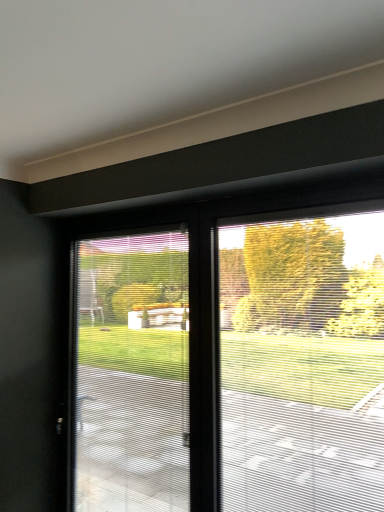
Question: Which direction should I rotate to face clear plastic window screen at center, which is the 1th window screen from left to right, — up or down?

Choices:
 (A) up
 (B) down

Answer: (B)

Question: Which direction should I rotate to look at frosted glass window screen at center, the first window screen when ordered from right to left?

Choices:
 (A) right
 (B) left

Answer: (A)

Question: Is clear plastic window screen at center, which is the 1th window screen from left to right, wider than frosted glass window screen at center, which ranks as the second window screen in left-to-right order?

Choices:
 (A) no
 (B) yes

Answer: (B)

Question: Does clear plastic window screen at center, which is the 1th window screen from left to right, appear on the right side of frosted glass window screen at center, the first window screen when ordered from right to left?

Choices:
 (A) yes
 (B) no

Answer: (B)

Question: From the image's perspective, is clear plastic window screen at center, which is counted as the second window screen, starting from the right, located beneath frosted glass window screen at center, which ranks as the second window screen in left-to-right order?

Choices:
 (A) yes
 (B) no

Answer: (A)

Question: Is the depth of clear plastic window screen at center, which is the 1th window screen from left to right, greater than that of frosted glass window screen at center, the first window screen when ordered from right to left?

Choices:
 (A) no
 (B) yes

Answer: (B)

Question: Does clear plastic window screen at center, which is the 1th window screen from left to right, have a lesser height compared to frosted glass window screen at center, the first window screen when ordered from right to left?

Choices:
 (A) no
 (B) yes

Answer: (A)

Question: From the image's perspective, would you say clear plastic window screen at center, which is counted as the second window screen, starting from the right, is positioned over frosted glass window screen at center, which ranks as the second window screen in left-to-right order?

Choices:
 (A) no
 (B) yes

Answer: (A)

Question: Could you tell me if frosted glass window screen at center, which ranks as the second window screen in left-to-right order, is facing clear plastic window screen at center, which is the 1th window screen from left to right?

Choices:
 (A) yes
 (B) no

Answer: (B)

Question: Is frosted glass window screen at center, the first window screen when ordered from right to left, next to clear plastic window screen at center, which is the 1th window screen from left to right, and touching it?

Choices:
 (A) yes
 (B) no

Answer: (B)

Question: Is frosted glass window screen at center, the first window screen when ordered from right to left, looking in the opposite direction of clear plastic window screen at center, which is the 1th window screen from left to right?

Choices:
 (A) yes
 (B) no

Answer: (B)

Question: Can you confirm if frosted glass window screen at center, the first window screen when ordered from right to left, is thinner than clear plastic window screen at center, which is the 1th window screen from left to right?

Choices:
 (A) yes
 (B) no

Answer: (A)

Question: Considering the relative sizes of frosted glass window screen at center, the first window screen when ordered from right to left, and clear plastic window screen at center, which is counted as the second window screen, starting from the right, in the image provided, is frosted glass window screen at center, the first window screen when ordered from right to left, taller than clear plastic window screen at center, which is counted as the second window screen, starting from the right,?

Choices:
 (A) no
 (B) yes

Answer: (A)

Question: From the image's perspective, is frosted glass window screen at center, which ranks as the second window screen in left-to-right order, on clear plastic window screen at center, which is counted as the second window screen, starting from the right?

Choices:
 (A) no
 (B) yes

Answer: (B)

Question: Does point coord(139,386) appear closer or farther from the camera than point coord(281,416)?

Choices:
 (A) closer
 (B) farther

Answer: (B)